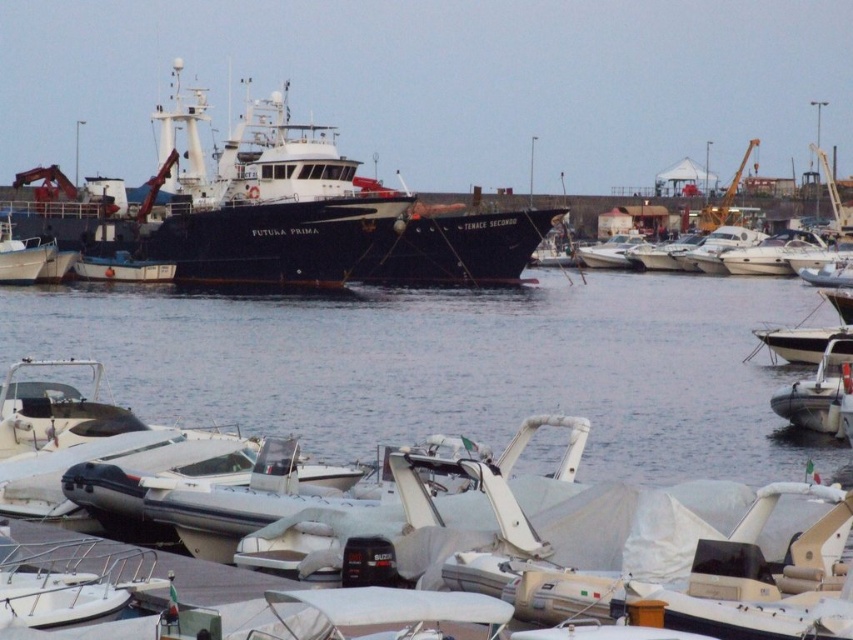
Question: Does black matte ship at center appear on the right side of white rubber dinghy at lower right?

Choices:
 (A) yes
 (B) no

Answer: (B)

Question: Among these points, which one is farthest from the camera?

Choices:
 (A) (842, 340)
 (B) (503, 244)

Answer: (B)

Question: Is black matte ship at center closer to the viewer compared to white rubber dinghy at lower right?

Choices:
 (A) yes
 (B) no

Answer: (B)

Question: Which point is closer to the camera?

Choices:
 (A) white rubber dinghy at lower right
 (B) black matte ship at center

Answer: (A)

Question: Which point is farther to the camera?

Choices:
 (A) black matte ship at center
 (B) white rubber dinghy at lower right

Answer: (A)

Question: Does black matte ship at center appear over white rubber dinghy at lower right?

Choices:
 (A) no
 (B) yes

Answer: (B)